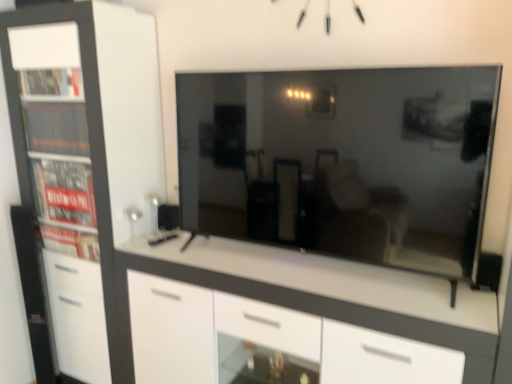
Locate an element on the screen. The width and height of the screenshot is (512, 384). matte black tv at center is located at coordinates (343, 162).

Considering the sizes of objects white matte cabinet at left and matte black tv at center in the image provided, who is thinner, white matte cabinet at left or matte black tv at center?

Thinner between the two is matte black tv at center.

Would you say white matte cabinet at left is to the left or to the right of matte black tv at center in the picture?

Clearly, white matte cabinet at left is on the left of matte black tv at center in the image.

Can we say white matte cabinet at left lies outside matte black tv at center?

Yes, white matte cabinet at left is outside of matte black tv at center.

Does white matte cabinet at left turn towards matte black tv at center?

No, white matte cabinet at left is not oriented towards matte black tv at center.

Does white matte cabinet at left have a greater height compared to white glossy chest of drawers at center?

Yes.

Is white matte cabinet at left oriented towards white glossy chest of drawers at center?

No, white matte cabinet at left is not aimed at white glossy chest of drawers at center.

Who is smaller, white matte cabinet at left or white glossy chest of drawers at center?

Smaller between the two is white matte cabinet at left.

Based on their positions, is white matte cabinet at left located to the left or right of white glossy chest of drawers at center?

In the image, white matte cabinet at left appears on the left side of white glossy chest of drawers at center.

In the image, is white glossy chest of drawers at center positioned in front of or behind matte black tv at center?

white glossy chest of drawers at center is positioned farther from the viewer than matte black tv at center.

Considering the relative sizes of white glossy chest of drawers at center and matte black tv at center in the image provided, is white glossy chest of drawers at center thinner than matte black tv at center?

In fact, white glossy chest of drawers at center might be wider than matte black tv at center.

Who is bigger, white glossy chest of drawers at center or matte black tv at center?

white glossy chest of drawers at center is bigger.

Is white glossy chest of drawers at center spatially inside matte black tv at center, or outside of it?

white glossy chest of drawers at center is outside matte black tv at center.

Which is more to the right, white glossy chest of drawers at center or white matte cabinet at left?

white glossy chest of drawers at center.

Is white glossy chest of drawers at center inside the boundaries of white matte cabinet at left, or outside?

white glossy chest of drawers at center is not enclosed by white matte cabinet at left.

Considering the positions of objects white glossy chest of drawers at center and white matte cabinet at left in the image provided, who is behind, white glossy chest of drawers at center or white matte cabinet at left?

white matte cabinet at left is further away from the camera.

Does matte black tv at center come in front of white glossy chest of drawers at center?

Yes.

Is matte black tv at center to the right of white glossy chest of drawers at center from the viewer's perspective?

Indeed, matte black tv at center is positioned on the right side of white glossy chest of drawers at center.

From the picture: Is matte black tv at center not near white glossy chest of drawers at center?

matte black tv at center is near white glossy chest of drawers at center, not far away.

The height and width of the screenshot is (384, 512). Identify the location of television in front of the white glossy chest of drawers at center. (343, 162).

Considering the sizes of matte black tv at center and white matte cabinet at left in the image, is matte black tv at center wider or thinner than white matte cabinet at left?

Clearly, matte black tv at center has less width compared to white matte cabinet at left.

Between matte black tv at center and white matte cabinet at left, which one is positioned in front?

matte black tv at center.

Based on the photo, is matte black tv at center facing away from white matte cabinet at left?

No, matte black tv at center is not facing the opposite direction of white matte cabinet at left.

Is matte black tv at center positioned far away from white matte cabinet at left?

No, matte black tv at center is not far from white matte cabinet at left.

I want to click on cabinetry on the left of the matte black tv at center, so click(x=85, y=169).

The width and height of the screenshot is (512, 384). I want to click on cabinetry behind the white glossy chest of drawers at center, so click(85, 169).

From the picture: When comparing their distances from white glossy chest of drawers at center, does matte black tv at center or white matte cabinet at left seem further?

Based on the image, white matte cabinet at left appears to be further to white glossy chest of drawers at center.

Based on their spatial positions, is white glossy chest of drawers at center or white matte cabinet at left closer to matte black tv at center?

Based on the image, white glossy chest of drawers at center appears to be nearer to matte black tv at center.

In the scene shown: When comparing their distances from white glossy chest of drawers at center, does white matte cabinet at left or matte black tv at center seem closer?

matte black tv at center is positioned closer to the anchor white glossy chest of drawers at center.

Based on their spatial positions, is white matte cabinet at left or white glossy chest of drawers at center further from matte black tv at center?

white matte cabinet at left.

Looking at the image, which one is located further to white matte cabinet at left, white glossy chest of drawers at center or matte black tv at center?

matte black tv at center.

Based on the photo, when comparing their distances from white matte cabinet at left, does matte black tv at center or white glossy chest of drawers at center seem closer?

The object closer to white matte cabinet at left is white glossy chest of drawers at center.

This screenshot has width=512, height=384. In order to click on the chest of drawers located between white matte cabinet at left and matte black tv at center in the left-right direction in this screenshot , I will do `click(339, 287)`.